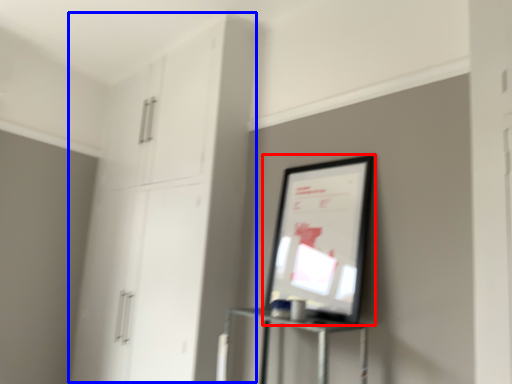
Question: Which of the following is the farthest to the observer, picture frame (highlighted by a red box) or dresser (highlighted by a blue box)?

Choices:
 (A) picture frame
 (B) dresser

Answer: (B)